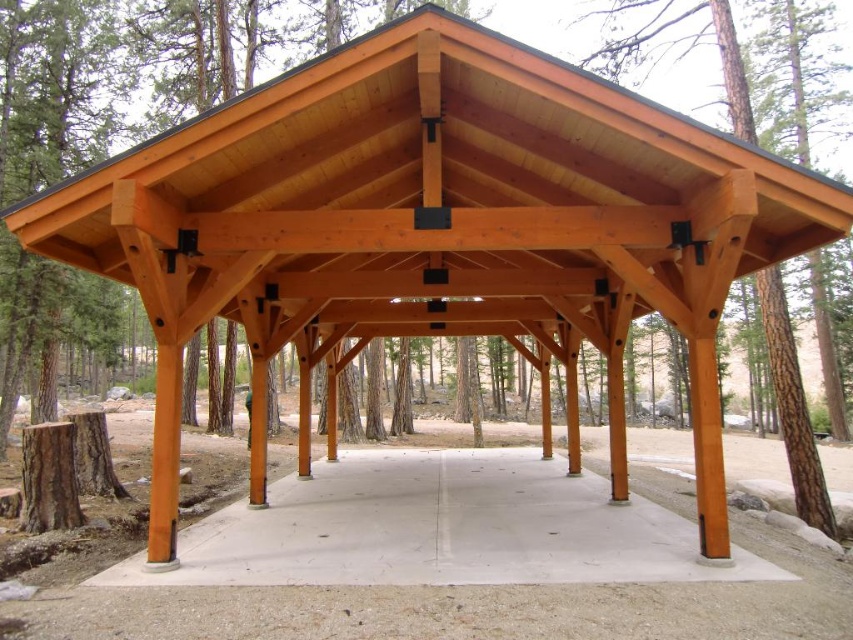
Between concrete at center and natural wood tree at center, which one has less height?

concrete at center is shorter.

Identify the location of concrete at center. (439, 529).